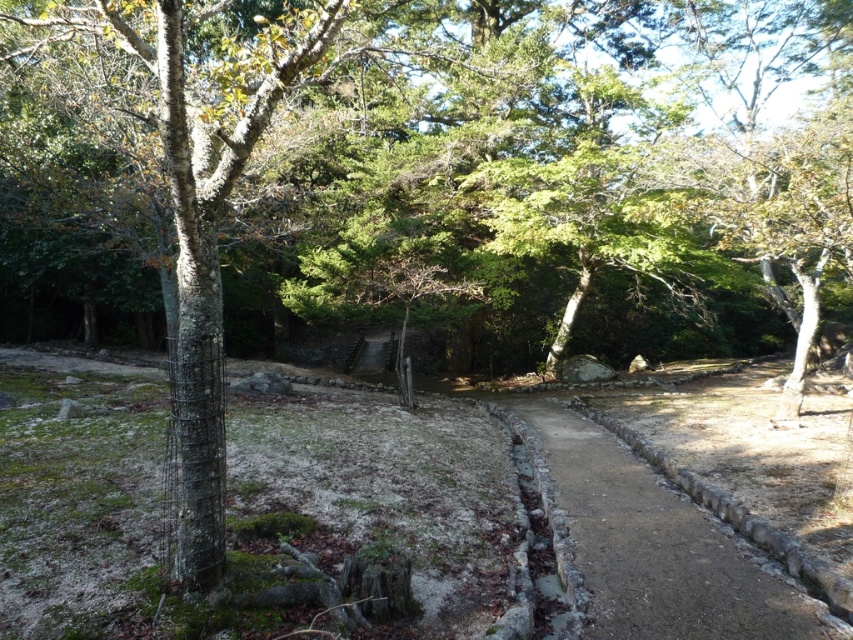
Can you confirm if smooth bark tree at left is positioned to the right of dirt path at center?

No, smooth bark tree at left is not to the right of dirt path at center.

Locate an element on the screen. This screenshot has width=853, height=640. smooth bark tree at left is located at coordinates (204, 225).